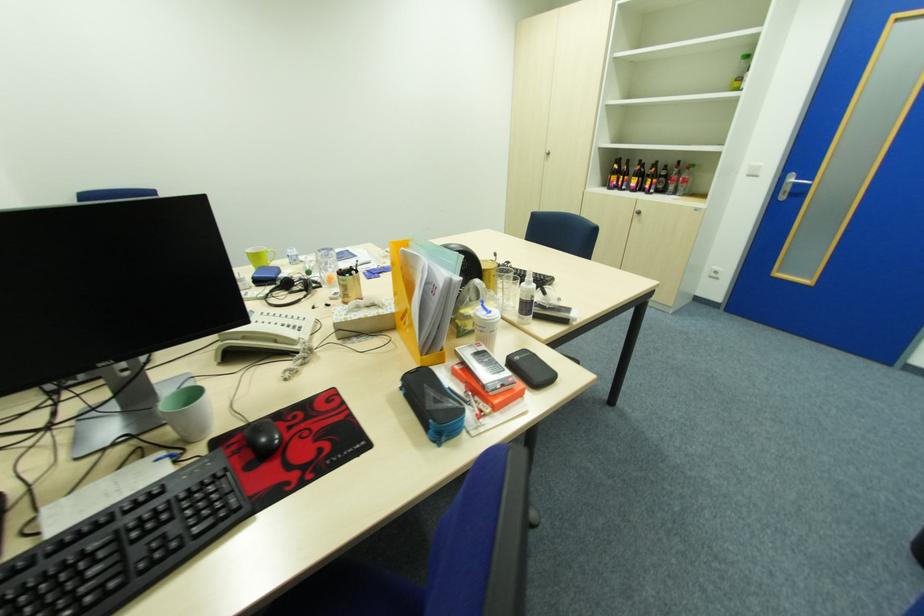
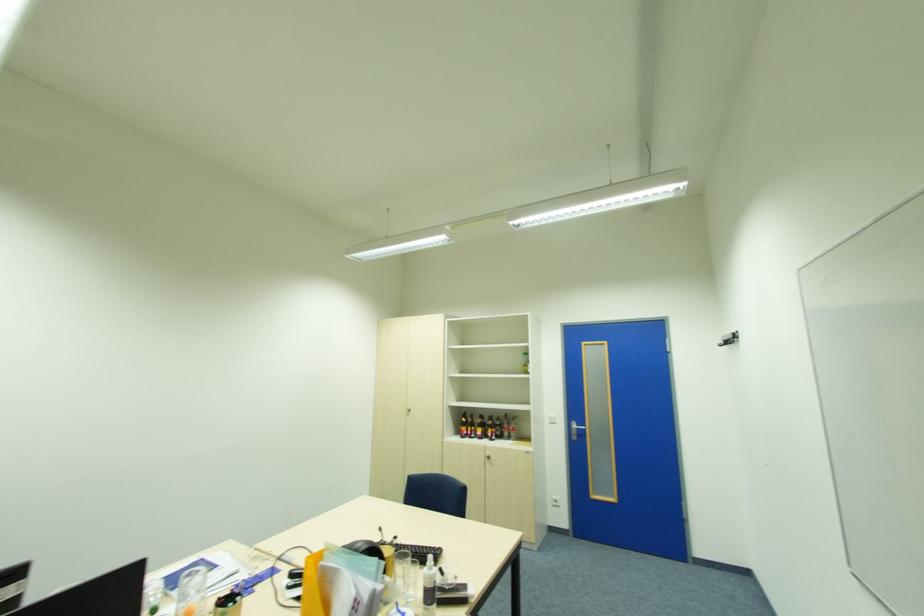
First-person continuous shooting, in which direction is the camera rotating?

The camera's rotation is toward right-up.